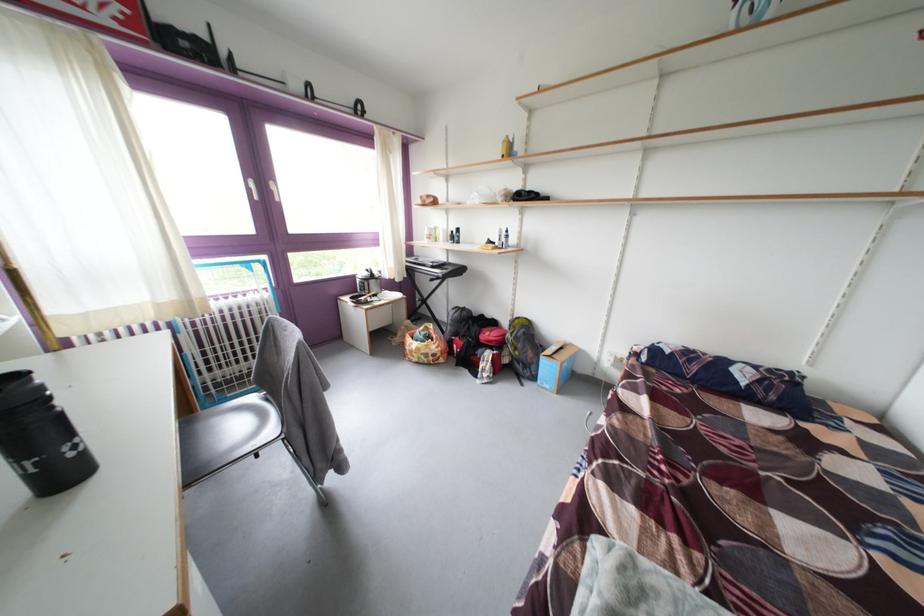
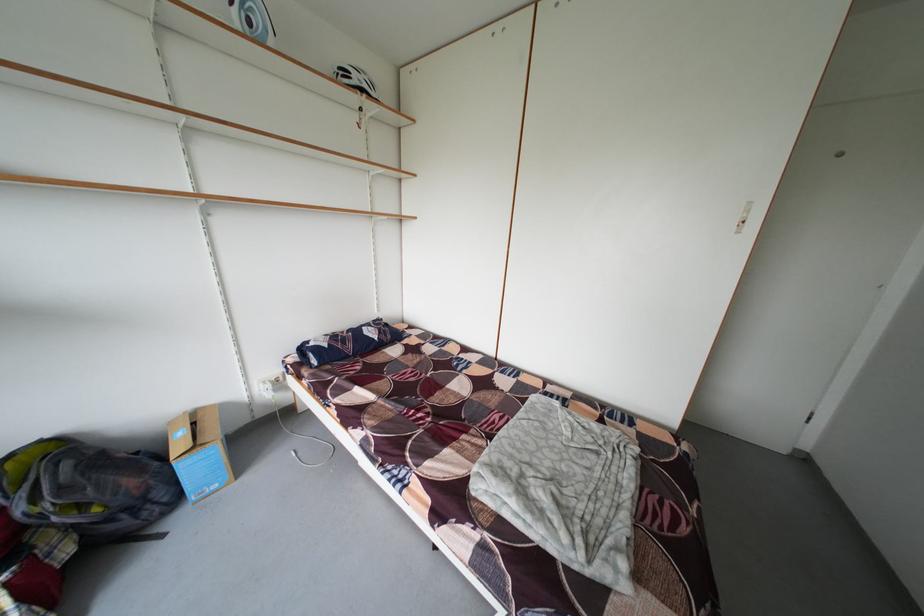
Find the pixel in the second image that matches [745,34] in the first image.

(249, 34)